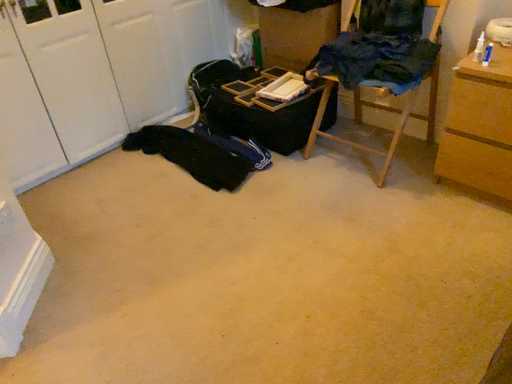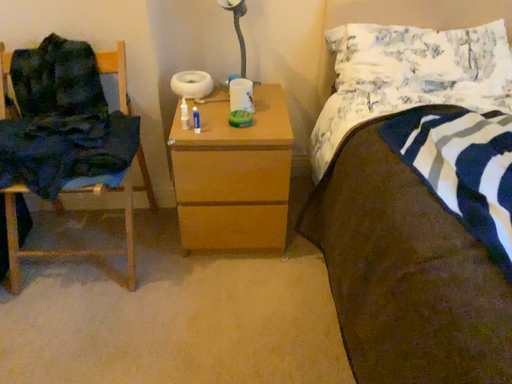
Question: How did the camera likely rotate when shooting the video?

Choices:
 (A) rotated right
 (B) rotated left

Answer: (A)